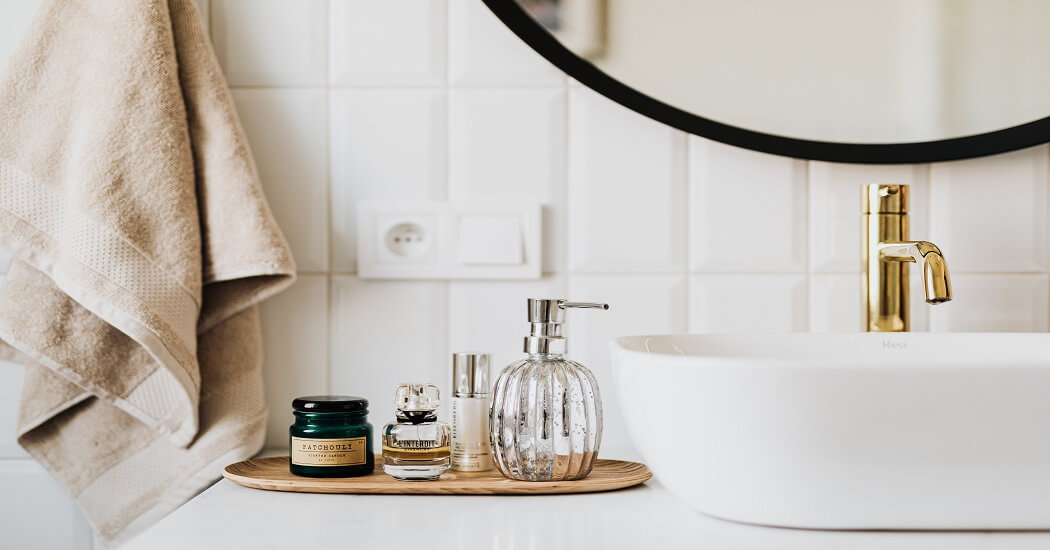
At what (x,y) coordinates should I click in order to perform the action: click on faucet. Please return your answer as a coordinate pair (x, y). This screenshot has width=1050, height=550. Looking at the image, I should click on (888, 244).